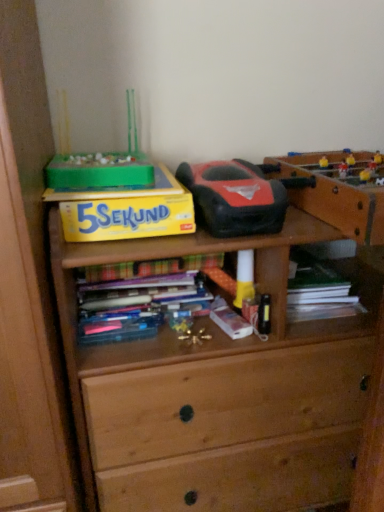
Question: Based on their sizes in the image, would you say wooden table at upper right is bigger or smaller than hardcover book at center?

Choices:
 (A) big
 (B) small

Answer: (A)

Question: Looking at their shapes, would you say wooden table at upper right is wider or thinner than hardcover book at center?

Choices:
 (A) wide
 (B) thin

Answer: (A)

Question: Which is farther from the hardcover book at center?

Choices:
 (A) wooden table at upper right
 (B) yellow matte paper at upper left
 (C) metallic gold toy at center, which is counted as the first toy, starting from the bottom
 (D) rubberized black and red toy car at center, which is the 2th toy in bottom-to-top order

Answer: (A)

Question: Estimate the real-world distances between objects in this image. Which object is closer to the metallic gold toy at center, the 2th toy positioned from the top?

Choices:
 (A) yellow matte paper at upper left
 (B) rubberized black and red toy car at center, placed as the 1th toy when sorted from top to bottom
 (C) hardcover book at center
 (D) wooden table at upper right

Answer: (C)